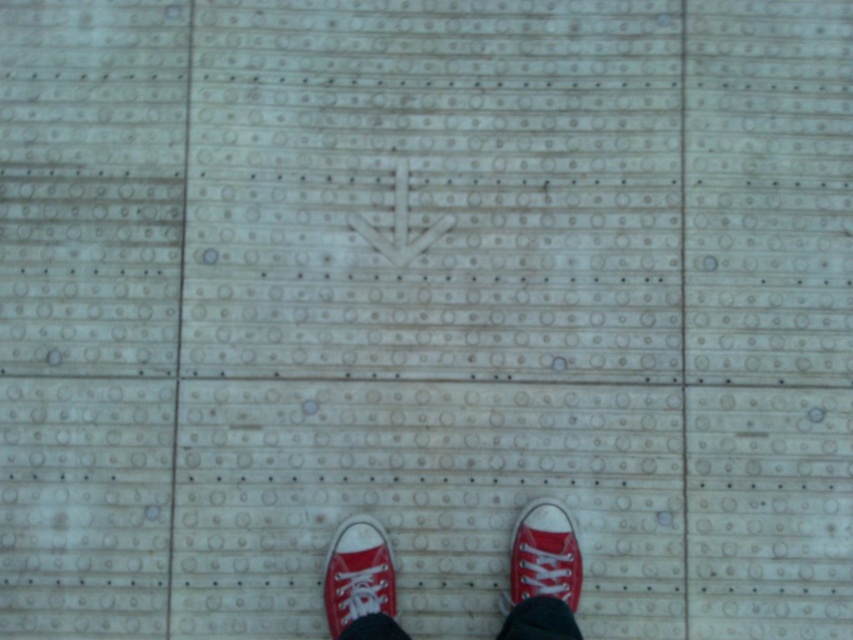
In the scene shown: You are standing in a room with a textured floor. You see two pairs of shoes at the center of the floor. One is labeled as red canvas shoes at center and the other as matte red sneaker at center. According to the scene description, which pair is directly above the other?

The matte red sneaker at center is directly above the red canvas shoes at center because the red canvas shoes at center is positioned under the matte red sneaker at center.

You are designing a shoe display stand for a store. The stand has two shelves. The top shelf is 12 inches wide and the bottom shelf is 10 inches wide. You have the matte red sneaker at center and the red canvas shoe at lower center. Which shoe should go on which shelf to ensure they fit properly?

The matte red sneaker at center is larger in size than the red canvas shoe at lower center. Therefore, the matte red sneaker at center should be placed on the wider top shelf that is 12 inches wide, and the red canvas shoe at lower center should go on the narrower bottom shelf that is 10 inches wide to ensure proper fit.